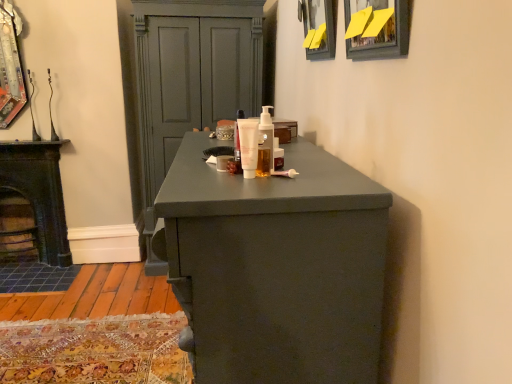
Where is `vacant area that is situated to the right of white matte tube at center, the first mouthwash in the front-to-back sequence`? vacant area that is situated to the right of white matte tube at center, the first mouthwash in the front-to-back sequence is located at coordinates (304, 173).